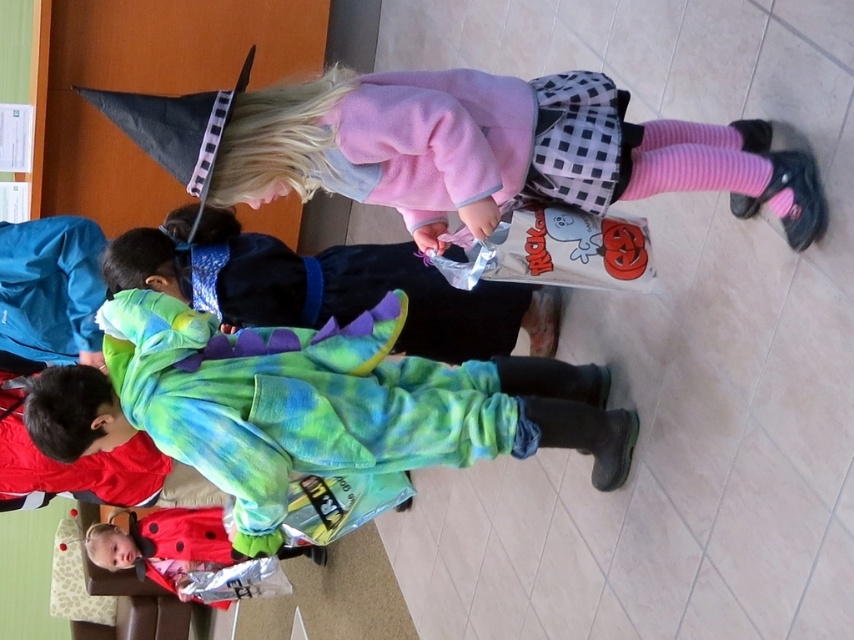
Question: Does fluffy green costume at center have a larger size compared to pink fleece sweater at upper center?

Choices:
 (A) yes
 (B) no

Answer: (A)

Question: Which point is closer to the camera?

Choices:
 (A) pink fleece sweater at upper center
 (B) fluffy green costume at center

Answer: (A)

Question: Is fluffy green costume at center smaller than pink fleece sweater at upper center?

Choices:
 (A) no
 (B) yes

Answer: (A)

Question: Can you confirm if fluffy green costume at center is smaller than pink fleece sweater at upper center?

Choices:
 (A) no
 (B) yes

Answer: (A)